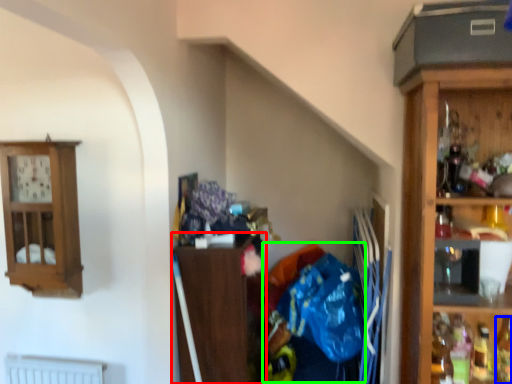
Question: Based on their relative distances, which object is farther from cabinetry (highlighted by a red box)? Choose from bottle (highlighted by a blue box) and waste (highlighted by a green box).

Choices:
 (A) bottle
 (B) waste

Answer: (A)